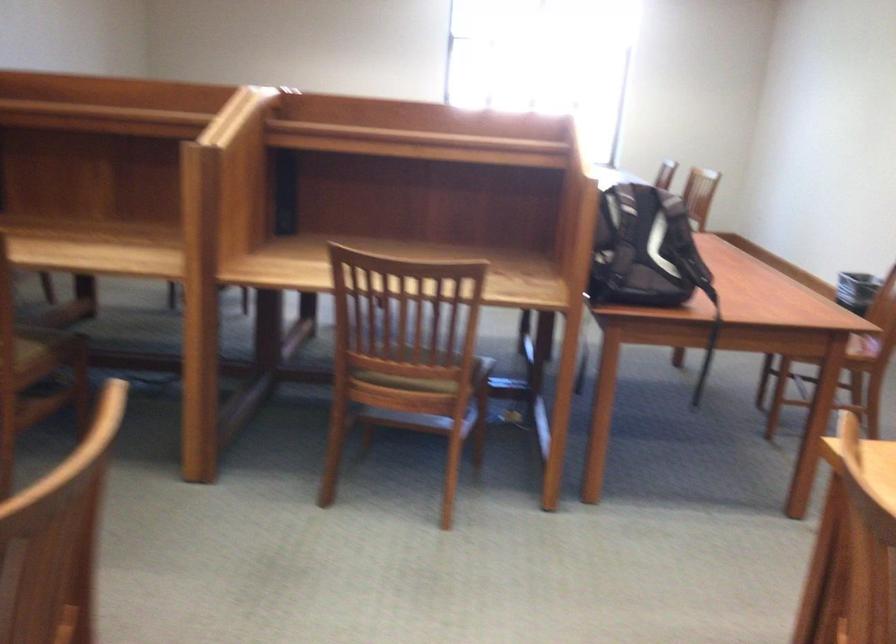
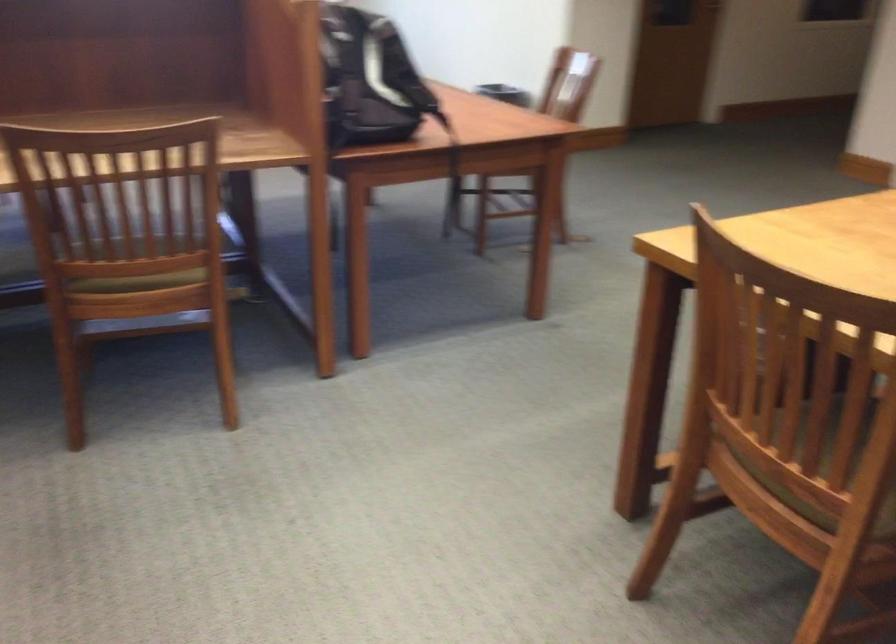
Question: I am providing you with two images of the same scene from different viewpoints. Please identify which objects are invisible in image2.

Choices:
 (A) chair sitting surface
 (B) black trash can
 (C) black backpack
 (D) cleaning bottle

Answer: (A)